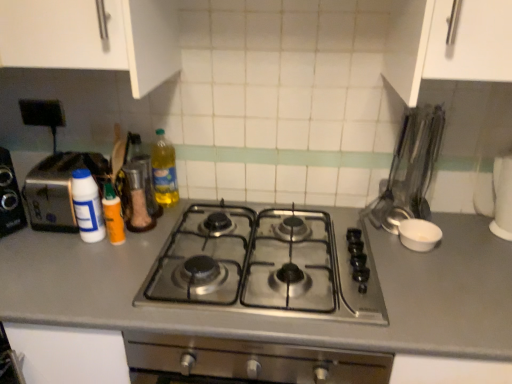
Question: From a real-world perspective, is translucent plastic bottle at center, the 3th bottle viewed from the left, over stainless steel gas stove at center?

Choices:
 (A) no
 (B) yes

Answer: (B)

Question: Is translucent plastic bottle at center, arranged as the first bottle when viewed from the right, oriented towards stainless steel gas stove at center?

Choices:
 (A) yes
 (B) no

Answer: (B)

Question: Is translucent plastic bottle at center, arranged as the first bottle when viewed from the right, to the left of stainless steel gas stove at center from the viewer's perspective?

Choices:
 (A) no
 (B) yes

Answer: (B)

Question: Is translucent plastic bottle at center, arranged as the first bottle when viewed from the right, far away from stainless steel gas stove at center?

Choices:
 (A) yes
 (B) no

Answer: (B)

Question: Is translucent plastic bottle at center, arranged as the first bottle when viewed from the right, with stainless steel gas stove at center?

Choices:
 (A) no
 (B) yes

Answer: (A)

Question: Would you say white plastic bottle at left, which is the 3th bottle from right to left, is to the left or to the right of translucent orange bottle at center left, which is counted as the second bottle, starting from the right, in the picture?

Choices:
 (A) right
 (B) left

Answer: (B)

Question: From the image's perspective, relative to translucent orange bottle at center left, which appears as the second bottle when viewed from the left, is white plastic bottle at left, placed as the first bottle when sorted from left to right, above or below?

Choices:
 (A) above
 (B) below

Answer: (A)

Question: Does point (82, 216) appear closer or farther from the camera than point (115, 223)?

Choices:
 (A) closer
 (B) farther

Answer: (B)

Question: Considering the positions of white plastic bottle at left, which is the 3th bottle from right to left, and translucent orange bottle at center left, which appears as the second bottle when viewed from the left, in the image, is white plastic bottle at left, which is the 3th bottle from right to left, taller or shorter than translucent orange bottle at center left, which appears as the second bottle when viewed from the left,?

Choices:
 (A) short
 (B) tall

Answer: (B)

Question: Considering their positions, is metallic silver utensils at right, the first appliance positioned from the top, located in front of or behind white matte bowl at right, which is the 2th appliance from top to bottom?

Choices:
 (A) front
 (B) behind

Answer: (A)

Question: From their relative heights in the image, would you say metallic silver utensils at right, the first appliance positioned from the top, is taller or shorter than white matte bowl at right, the first appliance ordered from the bottom?

Choices:
 (A) tall
 (B) short

Answer: (A)

Question: Do you think metallic silver utensils at right, acting as the second appliance starting from the bottom, is within white matte bowl at right, the first appliance ordered from the bottom, or outside of it?

Choices:
 (A) outside
 (B) inside

Answer: (A)

Question: Based on their positions, is metallic silver utensils at right, the first appliance positioned from the top, located to the left or right of white matte bowl at right, which is the 2th appliance from top to bottom?

Choices:
 (A) right
 (B) left

Answer: (B)

Question: Considering the positions of point (403, 238) and point (374, 205), is point (403, 238) closer or farther from the camera than point (374, 205)?

Choices:
 (A) farther
 (B) closer

Answer: (B)

Question: Is white matte bowl at right, which is the 2th appliance from top to bottom, taller or shorter than metallic silver utensils at right, acting as the second appliance starting from the bottom?

Choices:
 (A) short
 (B) tall

Answer: (A)